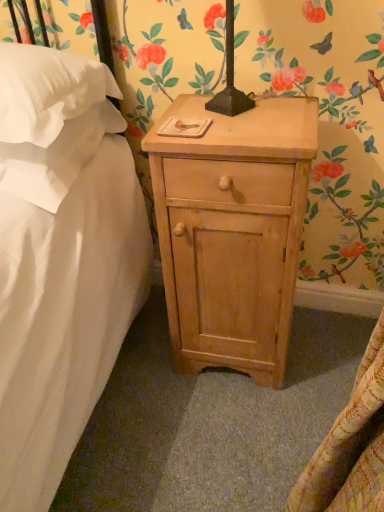
Question: From a real-world perspective, is natural wood nightstand at center above or below white soft pillow at upper left, the first pillow viewed from the top?

Choices:
 (A) below
 (B) above

Answer: (A)

Question: Considering the positions of natural wood nightstand at center and white soft pillow at upper left, which is counted as the second pillow, starting from the bottom, in the image, is natural wood nightstand at center wider or thinner than white soft pillow at upper left, which is counted as the second pillow, starting from the bottom,?

Choices:
 (A) wide
 (B) thin

Answer: (B)

Question: Based on their relative distances, which object is nearer to the white soft pillow at upper left, the first pillow viewed from the top?

Choices:
 (A) natural wood nightstand at center
 (B) white soft pillow at upper left, arranged as the first pillow when ordered from the bottom

Answer: (B)

Question: Which object is the farthest from the natural wood nightstand at center?

Choices:
 (A) white soft pillow at upper left, the second pillow when ordered from top to bottom
 (B) white soft pillow at upper left, which is counted as the second pillow, starting from the bottom

Answer: (B)